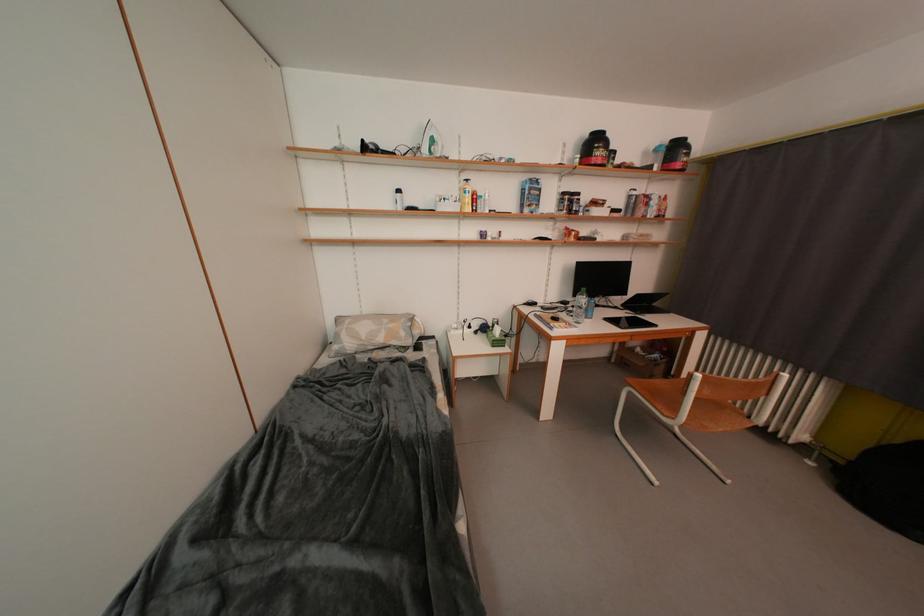
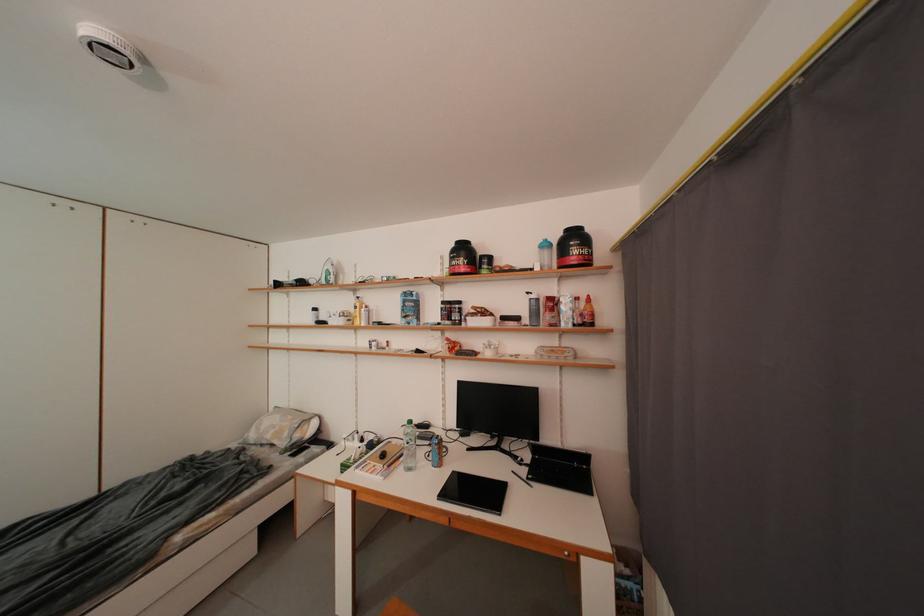
In the second image, find the point that corresponds to point (563, 322) in the first image.

(391, 459)